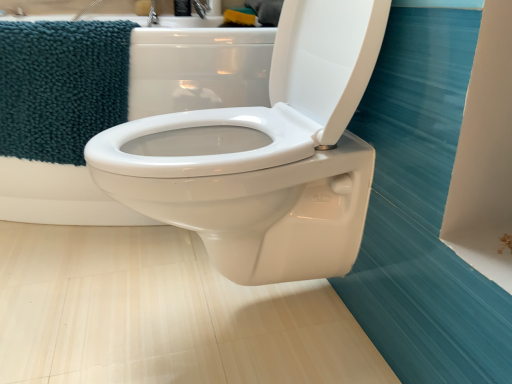
Question: From their relative heights in the image, would you say teal plush towel at upper left is taller or shorter than white glossy toilet at center?

Choices:
 (A) short
 (B) tall

Answer: (A)

Question: Looking at their shapes, would you say teal plush towel at upper left is wider or thinner than white glossy toilet at center?

Choices:
 (A) thin
 (B) wide

Answer: (A)

Question: Relative to white glossy toilet at center, is teal plush towel at upper left in front or behind?

Choices:
 (A) front
 (B) behind

Answer: (B)

Question: From a real-world perspective, is white glossy toilet at center positioned above or below teal plush towel at upper left?

Choices:
 (A) below
 (B) above

Answer: (A)

Question: Would you say white glossy toilet at center is inside or outside teal plush towel at upper left?

Choices:
 (A) outside
 (B) inside

Answer: (A)

Question: Considering the positions of point (205, 77) and point (102, 107), is point (205, 77) closer or farther from the camera than point (102, 107)?

Choices:
 (A) farther
 (B) closer

Answer: (A)

Question: From the image's perspective, is white glossy toilet at center positioned above or below teal plush towel at upper left?

Choices:
 (A) above
 (B) below

Answer: (A)